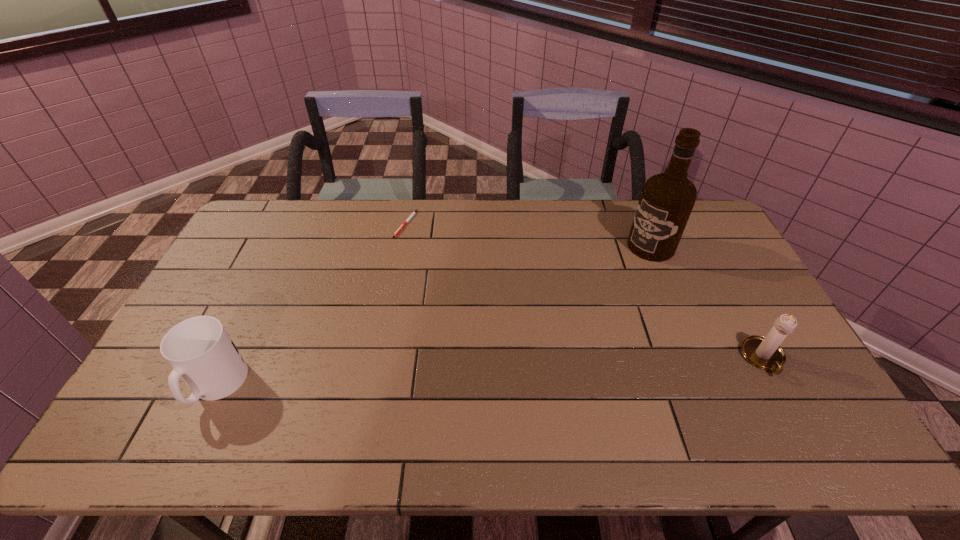
At what (x,y) coordinates should I click in order to perform the action: click on vacant space located 0.070m on the clicker of the pen. Please return your answer as a coordinate pair (x, y). The width and height of the screenshot is (960, 540). Looking at the image, I should click on tap(405, 252).

Where is `free space located on the clicker of the pen`? The width and height of the screenshot is (960, 540). free space located on the clicker of the pen is located at coordinates (409, 313).

I want to click on vacant region located on the clicker of the pen, so click(407, 276).

Locate an element on the screen. The height and width of the screenshot is (540, 960). alcohol present at the far edge is located at coordinates (667, 199).

At what (x,y) coordinates should I click in order to perform the action: click on pen that is at the far edge. Please return your answer as a coordinate pair (x, y). Looking at the image, I should click on (401, 227).

The image size is (960, 540). Identify the location of object that is positioned at the near edge. (199, 349).

The width and height of the screenshot is (960, 540). In order to click on object present at the left edge in this screenshot , I will do `click(199, 349)`.

Where is `object that is positioned at the right edge`? object that is positioned at the right edge is located at coordinates (765, 353).

At what (x,y) coordinates should I click in order to perform the action: click on object at the near left corner. Please return your answer as a coordinate pair (x, y). The height and width of the screenshot is (540, 960). Looking at the image, I should click on (199, 349).

The width and height of the screenshot is (960, 540). In the image, there is a desktop. In order to click on vacant region at the far edge in this screenshot , I will do `click(287, 240)`.